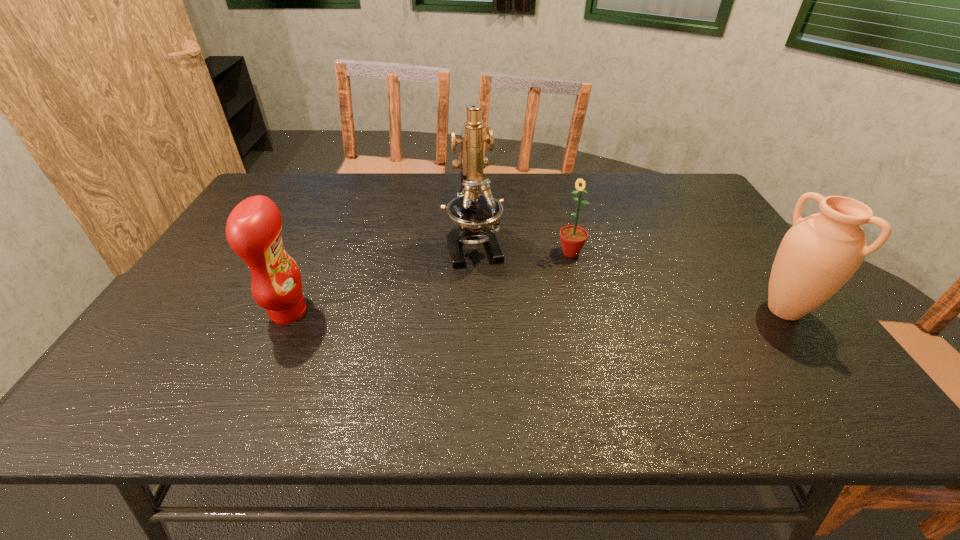
Locate an element on the screen. condiment is located at coordinates (254, 227).

The width and height of the screenshot is (960, 540). Find the location of `the rightmost object`. the rightmost object is located at coordinates (820, 253).

Locate an element on the screen. the third object from left to right is located at coordinates (573, 238).

I want to click on the shortest object, so click(x=573, y=238).

Locate an element on the screen. The width and height of the screenshot is (960, 540). the tallest object is located at coordinates (473, 212).

This screenshot has height=540, width=960. In order to click on microscope in this screenshot , I will do `click(473, 212)`.

Find the location of a particular element. Image resolution: width=960 pixels, height=540 pixels. vacant region located 0.050m on the label side of the condiment is located at coordinates (328, 312).

Identify the location of vacant space situated 0.400m on the back of the rightmost object. The width and height of the screenshot is (960, 540). (708, 207).

This screenshot has width=960, height=540. I want to click on free space located on the face of the third object from left to right, so click(x=483, y=322).

Image resolution: width=960 pixels, height=540 pixels. In order to click on vacant space situated 0.400m on the face of the third object from left to right in this screenshot , I will do `click(463, 338)`.